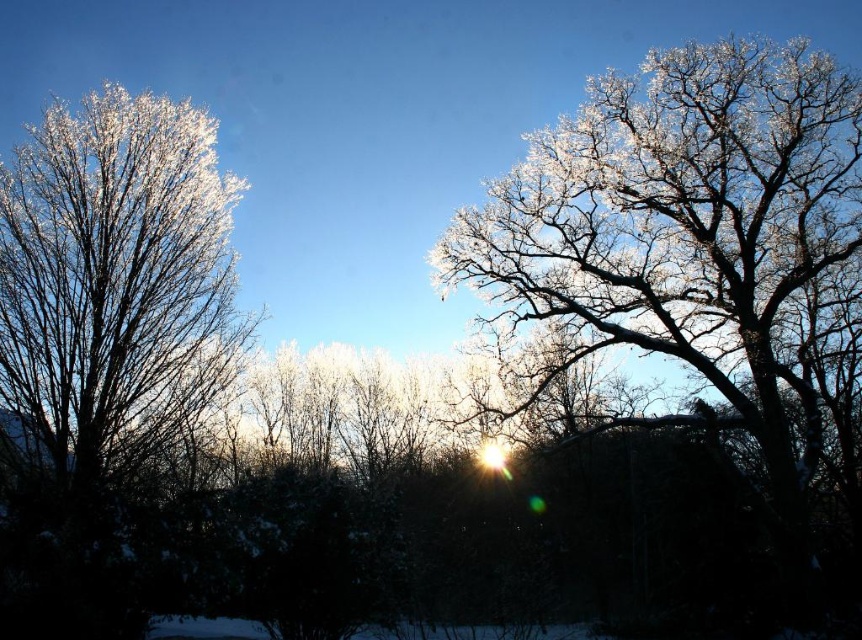
Question: Does frosted white tree at upper right have a greater width compared to frosty white branches at left?

Choices:
 (A) no
 (B) yes

Answer: (B)

Question: Is frosted white tree at upper right below frosty white branches at left?

Choices:
 (A) yes
 (B) no

Answer: (B)

Question: Which of the following is the closest to the observer?

Choices:
 (A) frosted white tree at upper right
 (B) frosty white branches at left

Answer: (B)

Question: Does frosted white tree at upper right have a larger size compared to frosty white branches at left?

Choices:
 (A) no
 (B) yes

Answer: (B)

Question: Which of the following is the farthest from the observer?

Choices:
 (A) (800, 97)
 (B) (110, 211)

Answer: (A)